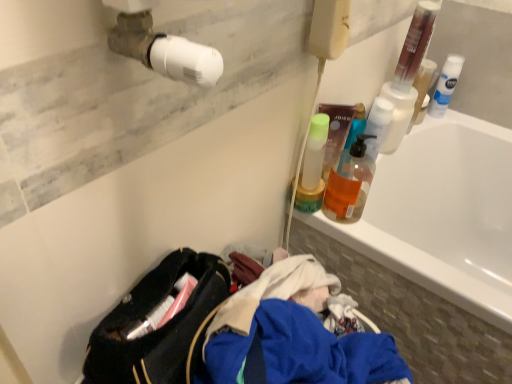
This screenshot has width=512, height=384. What do you see at coordinates (349, 183) in the screenshot?
I see `translucent orange liquid at upper right` at bounding box center [349, 183].

This screenshot has width=512, height=384. What do you see at coordinates (442, 214) in the screenshot? I see `white glossy bathtub at upper right` at bounding box center [442, 214].

The width and height of the screenshot is (512, 384). I want to click on translucent plastic pump bottle at upper right, acting as the 2th cleaning product starting from the back, so click(x=352, y=139).

Which of these two, translucent plastic pump bottle at upper right, the first cleaning product positioned from the front, or white matte shaving cream can at upper right, the 2th cleaning product viewed from the left, stands taller?

white matte shaving cream can at upper right, the 2th cleaning product viewed from the left.

From a real-world perspective, between translucent plastic pump bottle at upper right, arranged as the 1th cleaning product when ordered from the bottom, and white matte shaving cream can at upper right, which is counted as the 1th cleaning product, starting from the top, who is vertically lower?

translucent plastic pump bottle at upper right, arranged as the 1th cleaning product when ordered from the bottom, from a real-world perspective.

How many degrees apart are the facing directions of translucent plastic pump bottle at upper right, acting as the second cleaning product starting from the top, and white matte shaving cream can at upper right, marked as the second cleaning product in a front-to-back arrangement?

There is a 0.00747-degree angle between the facing directions of translucent plastic pump bottle at upper right, acting as the second cleaning product starting from the top, and white matte shaving cream can at upper right, marked as the second cleaning product in a front-to-back arrangement.

Considering the relative sizes of translucent plastic pump bottle at upper right, arranged as the 1th cleaning product when ordered from the bottom, and white matte shaving cream can at upper right, marked as the second cleaning product in a front-to-back arrangement, in the image provided, is translucent plastic pump bottle at upper right, arranged as the 1th cleaning product when ordered from the bottom, thinner than white matte shaving cream can at upper right, marked as the second cleaning product in a front-to-back arrangement,?

In fact, translucent plastic pump bottle at upper right, arranged as the 1th cleaning product when ordered from the bottom, might be wider than white matte shaving cream can at upper right, marked as the second cleaning product in a front-to-back arrangement.

Between translucent orange liquid at upper right and white glossy bathtub at upper right, which one is positioned in front?

white glossy bathtub at upper right is closer to the camera.

Does translucent orange liquid at upper right appear on the right side of white glossy bathtub at upper right?

No, translucent orange liquid at upper right is not to the right of white glossy bathtub at upper right.

Is translucent orange liquid at upper right looking in the opposite direction of white glossy bathtub at upper right?

No, translucent orange liquid at upper right is not facing the opposite direction of white glossy bathtub at upper right.

Looking at this image, from the image's perspective, which is below, translucent orange liquid at upper right or white glossy bathtub at upper right?

white glossy bathtub at upper right is shown below in the image.

From the image's perspective, is translucent plastic pump bottle at upper right, acting as the 2th cleaning product starting from the back, located above translucent orange liquid at upper right?

Yes, from the image's perspective, translucent plastic pump bottle at upper right, acting as the 2th cleaning product starting from the back, is over translucent orange liquid at upper right.

How far apart are translucent plastic pump bottle at upper right, the first cleaning product positioned from the front, and translucent orange liquid at upper right?

translucent plastic pump bottle at upper right, the first cleaning product positioned from the front, and translucent orange liquid at upper right are 1.40 inches apart.

Locate an element on the screen. the 1st cleaning product positioned above the translucent orange liquid at upper right (from a real-world perspective) is located at coordinates (352, 139).

Does translucent plastic pump bottle at upper right, arranged as the 1th cleaning product when ordered from the bottom, touch translucent orange liquid at upper right?

Yes, translucent plastic pump bottle at upper right, arranged as the 1th cleaning product when ordered from the bottom, and translucent orange liquid at upper right clearly make contact.

Between white glossy bathtub at upper right and translucent orange liquid at upper right, which one has smaller width?

translucent orange liquid at upper right is thinner.

Is white glossy bathtub at upper right shorter than translucent orange liquid at upper right?

In fact, white glossy bathtub at upper right may be taller than translucent orange liquid at upper right.

Does white glossy bathtub at upper right lie behind translucent orange liquid at upper right?

That is False.

Is white matte shaving cream can at upper right, which is the second cleaning product from bottom to top, next to white glossy bathtub at upper right and touching it?

white matte shaving cream can at upper right, which is the second cleaning product from bottom to top, is not next to white glossy bathtub at upper right, and they're not touching.

Considering the sizes of white matte shaving cream can at upper right, which ranks as the 1th cleaning product in back-to-front order, and white glossy bathtub at upper right in the image, is white matte shaving cream can at upper right, which ranks as the 1th cleaning product in back-to-front order, bigger or smaller than white glossy bathtub at upper right?

Considering their sizes, white matte shaving cream can at upper right, which ranks as the 1th cleaning product in back-to-front order, takes up less space than white glossy bathtub at upper right.

Does white matte shaving cream can at upper right, which is counted as the 1th cleaning product, starting from the top, lie behind white glossy bathtub at upper right?

Yes, white matte shaving cream can at upper right, which is counted as the 1th cleaning product, starting from the top, is further from the viewer.

At what (x,y) coordinates should I click in order to perform the action: click on cleaning product that is the 2nd one above the white glossy bathtub at upper right (from a real-world perspective). Please return your answer as a coordinate pair (x, y). Looking at the image, I should click on (445, 85).

The image size is (512, 384). I want to click on the 1st cleaning product above the translucent orange liquid at upper right (from the image's perspective), so click(352, 139).

From their relative heights in the image, would you say translucent orange liquid at upper right is taller or shorter than translucent plastic pump bottle at upper right, the 1th cleaning product positioned from the left?

Clearly, translucent orange liquid at upper right is taller compared to translucent plastic pump bottle at upper right, the 1th cleaning product positioned from the left.

From the image's perspective, is translucent orange liquid at upper right located above or below translucent plastic pump bottle at upper right, placed as the 2th cleaning product when sorted from right to left?

translucent orange liquid at upper right is situated lower than translucent plastic pump bottle at upper right, placed as the 2th cleaning product when sorted from right to left, in the image.

Is translucent orange liquid at upper right completely or partially outside of white matte shaving cream can at upper right, the first cleaning product in the right-to-left sequence?

Yes, translucent orange liquid at upper right is not within white matte shaving cream can at upper right, the first cleaning product in the right-to-left sequence.

Is point (353, 187) closer to camera compared to point (437, 88)?

Yes.

Consider the image. Considering the relative sizes of translucent orange liquid at upper right and white matte shaving cream can at upper right, the 2th cleaning product viewed from the left, in the image provided, is translucent orange liquid at upper right bigger than white matte shaving cream can at upper right, the 2th cleaning product viewed from the left,?

Yes.

Locate an element on the screen. Image resolution: width=512 pixels, height=384 pixels. cleaning product below the white matte shaving cream can at upper right, marked as the second cleaning product in a front-to-back arrangement (from a real-world perspective) is located at coordinates (352, 139).

Locate an element on the screen. This screenshot has width=512, height=384. bottle located behind the white glossy bathtub at upper right is located at coordinates (349, 183).

Estimate the real-world distances between objects in this image. Which object is further from translucent plastic pump bottle at upper right, placed as the 2th cleaning product when sorted from right to left, white matte shaving cream can at upper right, which is the second cleaning product from bottom to top, or white glossy bathtub at upper right?

The object further to translucent plastic pump bottle at upper right, placed as the 2th cleaning product when sorted from right to left, is white matte shaving cream can at upper right, which is the second cleaning product from bottom to top.

Looking at the image, which one is located further to translucent orange liquid at upper right, translucent plastic pump bottle at upper right, the 1th cleaning product positioned from the left, or white glossy bathtub at upper right?

The object further to translucent orange liquid at upper right is white glossy bathtub at upper right.

Based on their spatial positions, is white matte shaving cream can at upper right, the 2th cleaning product viewed from the left, or translucent orange liquid at upper right further from translucent plastic pump bottle at upper right, acting as the second cleaning product starting from the top?

white matte shaving cream can at upper right, the 2th cleaning product viewed from the left, is further to translucent plastic pump bottle at upper right, acting as the second cleaning product starting from the top.

Which object lies nearer to the anchor point translucent plastic pump bottle at upper right, acting as the 2th cleaning product starting from the back, white glossy bathtub at upper right or white matte shaving cream can at upper right, the 2th cleaning product viewed from the left?

white glossy bathtub at upper right is positioned closer to the anchor translucent plastic pump bottle at upper right, acting as the 2th cleaning product starting from the back.

Which object lies nearer to the anchor point white glossy bathtub at upper right, translucent plastic pump bottle at upper right, arranged as the 1th cleaning product when ordered from the bottom, or white matte shaving cream can at upper right, which is counted as the 1th cleaning product, starting from the top?

white matte shaving cream can at upper right, which is counted as the 1th cleaning product, starting from the top, is positioned closer to the anchor white glossy bathtub at upper right.

Estimate the real-world distances between objects in this image. Which object is further from white glossy bathtub at upper right, white matte shaving cream can at upper right, which ranks as the 1th cleaning product in back-to-front order, or translucent plastic pump bottle at upper right, acting as the 2th cleaning product starting from the back?

translucent plastic pump bottle at upper right, acting as the 2th cleaning product starting from the back, is positioned further to the anchor white glossy bathtub at upper right.

When comparing their distances from white matte shaving cream can at upper right, which is counted as the 1th cleaning product, starting from the top, does translucent plastic pump bottle at upper right, acting as the 2th cleaning product starting from the back, or translucent orange liquid at upper right seem closer?

translucent plastic pump bottle at upper right, acting as the 2th cleaning product starting from the back, lies closer to white matte shaving cream can at upper right, which is counted as the 1th cleaning product, starting from the top, than the other object.

Based on their spatial positions, is translucent plastic pump bottle at upper right, arranged as the 1th cleaning product when ordered from the bottom, or white matte shaving cream can at upper right, which is counted as the 1th cleaning product, starting from the top, closer to translucent orange liquid at upper right?

The object closer to translucent orange liquid at upper right is translucent plastic pump bottle at upper right, arranged as the 1th cleaning product when ordered from the bottom.

I want to click on cleaning product between translucent orange liquid at upper right and white matte shaving cream can at upper right, the 2th cleaning product viewed from the left, in the horizontal direction, so click(352, 139).

What are the coordinates of `bottle between white matte shaving cream can at upper right, which is counted as the 1th cleaning product, starting from the top, and white glossy bathtub at upper right from top to bottom` in the screenshot? It's located at (349, 183).

Locate an element on the screen. cleaning product between white matte shaving cream can at upper right, which is counted as the 1th cleaning product, starting from the top, and white glossy bathtub at upper right, in the vertical direction is located at coordinates (352, 139).

The height and width of the screenshot is (384, 512). I want to click on cleaning product between translucent orange liquid at upper right and white glossy bathtub at upper right in the horizontal direction, so click(x=352, y=139).